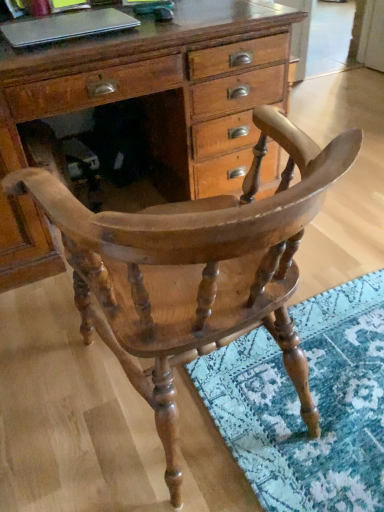
Image resolution: width=384 pixels, height=512 pixels. Find the location of `vacant space in front of silver metallic laptop at upper left`. vacant space in front of silver metallic laptop at upper left is located at coordinates pos(61,50).